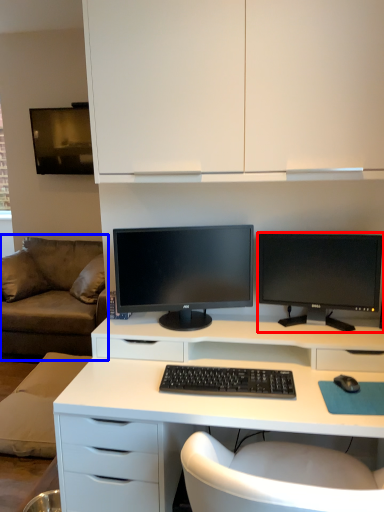
Question: Which object appears closest to the camera in this image, computer monitor (highlighted by a red box) or studio couch (highlighted by a blue box)?

Choices:
 (A) computer monitor
 (B) studio couch

Answer: (A)